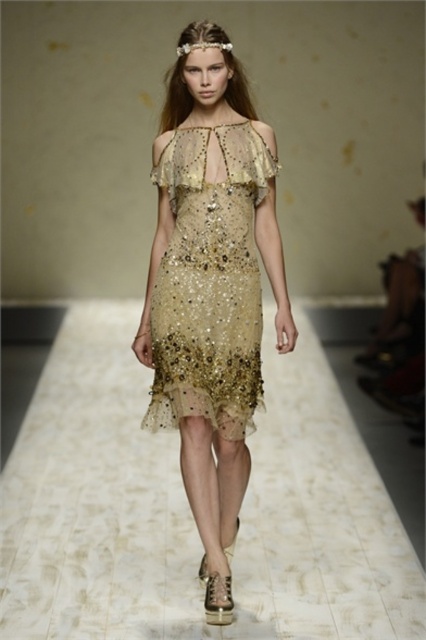
Question: Is gold sequined dress at center wider than shimmering sequined dress at center?

Choices:
 (A) yes
 (B) no

Answer: (A)

Question: Which object is closer to the camera taking this photo?

Choices:
 (A) shimmering sequined dress at center
 (B) gold sequined dress at center

Answer: (B)

Question: Which object appears closest to the camera in this image?

Choices:
 (A) gold sequined dress at center
 (B) shimmering sequined dress at center

Answer: (A)

Question: Can you confirm if gold sequined dress at center is bigger than shimmering sequined dress at center?

Choices:
 (A) yes
 (B) no

Answer: (A)

Question: Does gold sequined dress at center appear on the right side of shimmering sequined dress at center?

Choices:
 (A) yes
 (B) no

Answer: (B)